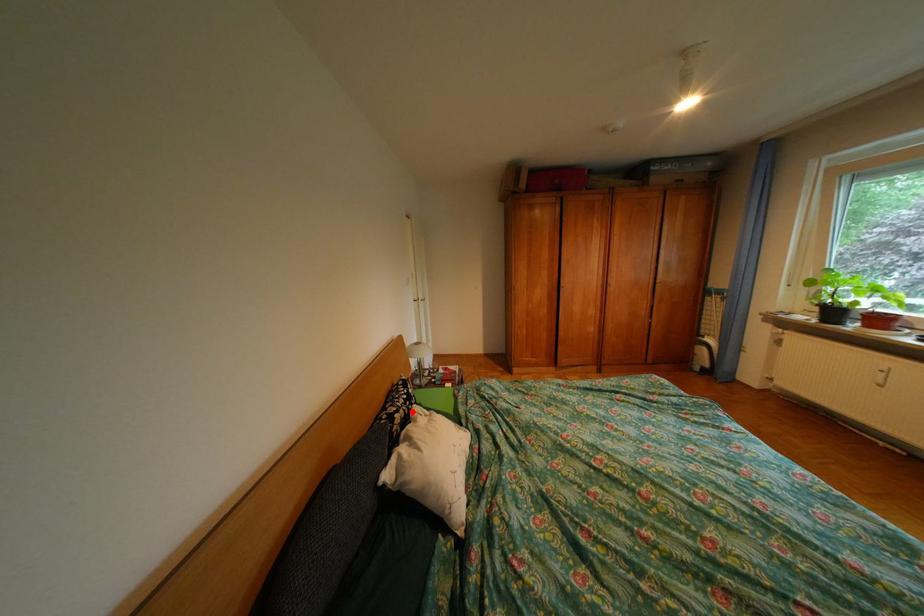
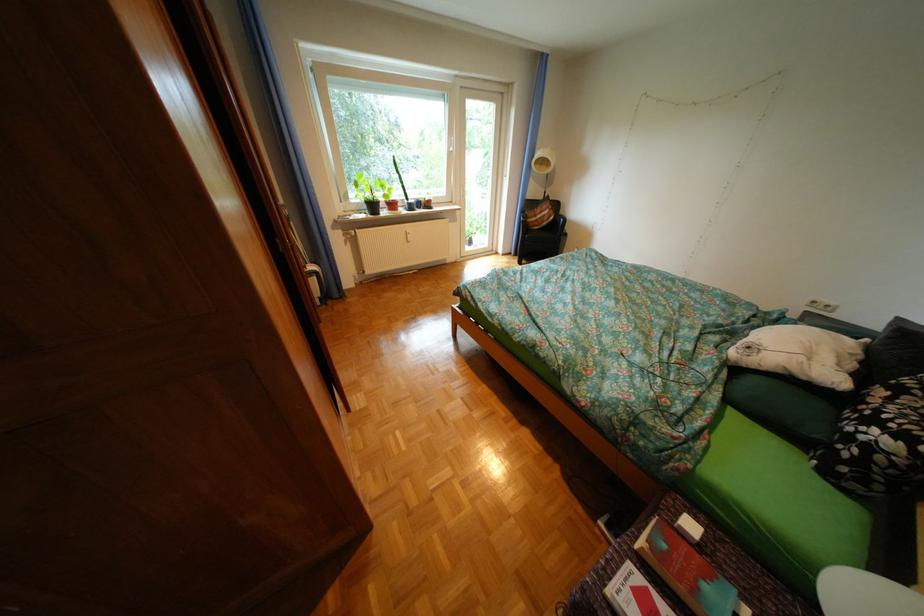
Locate, in the second image, the point that corresponds to the highlighted location in the first image.

(904, 399)